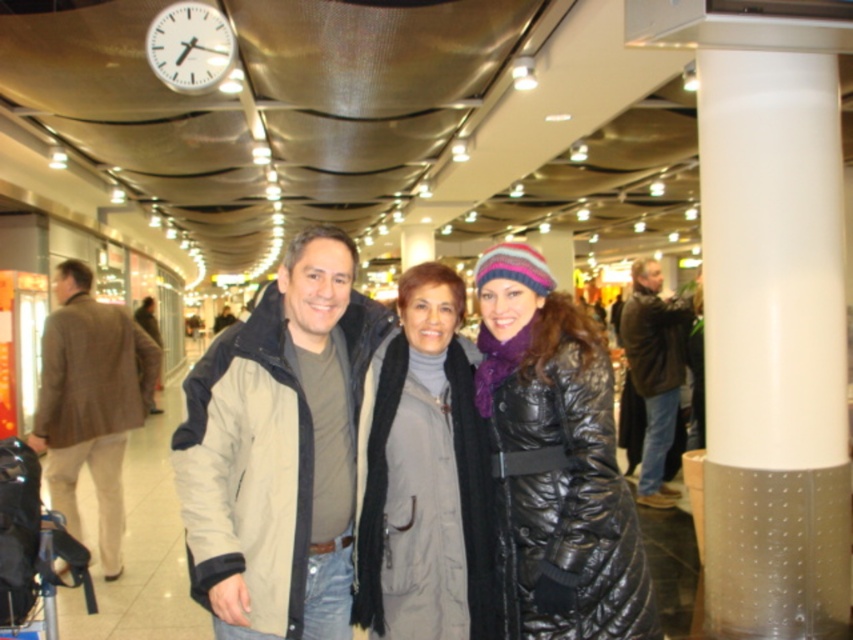
Based on the photo, you are a photographer trying to capture a clear shot of the matte beige jacket at center and the gray matte jacket at center. Since both are in the same area, which one do you need to focus on first to ensure it isn t blocked by the other?

The matte beige jacket at center is in front of the gray matte jacket at center, so you should focus on the matte beige jacket at center first to ensure it isn t blocked by the gray matte jacket at center.

You are trying to decide between two jackets displayed in a store window at the shopping mall. The matte beige jacket at center and the beige fabric jacket at center are side by side. Based on their appearance, which one do you think is wider?

The matte beige jacket at center is wider than the beige fabric jacket at center according to the description.

You are a photographer standing in the shopping mall and want to take a photo of the matte beige jacket at center and the beige fabric jacket at center. The minimum distance required for your camera to focus clearly on both subjects simultaneously is 5 inches. Can you capture both jackets in focus without moving either jacket?

The distance between the matte beige jacket at center and the beige fabric jacket at center is 4.95 inches, which is less than the 5 inches required by your camera. Therefore, you can capture both jackets in focus without moving them.